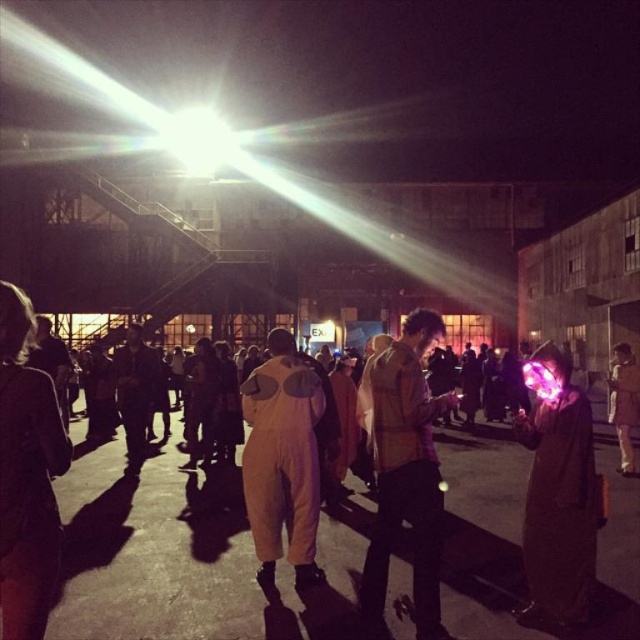
Can you confirm if matte purple orb at right is smaller than light brown fabric jacket at center?

No, matte purple orb at right is not smaller than light brown fabric jacket at center.

Between point (524, 518) and point (620, 472), which one is positioned in front?

Point (524, 518) is in front.

Identify the location of matte purple orb at right. (560, 499).

Is light brown leather jacket at lower left shorter than dark fabric jacket at center?

Yes, light brown leather jacket at lower left is shorter than dark fabric jacket at center.

Can you confirm if light brown leather jacket at lower left is positioned above dark fabric jacket at center?

Correct, light brown leather jacket at lower left is located above dark fabric jacket at center.

At what (x,y) coordinates should I click in order to perform the action: click on light brown leather jacket at lower left. Please return your answer as a coordinate pair (x, y). The height and width of the screenshot is (640, 640). Looking at the image, I should click on (26, 476).

Is light brown jumpsuit at center closer to the viewer compared to light brown fabric jacket at center?

Yes, light brown jumpsuit at center is closer to the viewer.

Does point (305, 512) lie in front of point (628, 467)?

Yes, it is in front of point (628, 467).

I want to click on light brown jumpsuit at center, so click(282, 460).